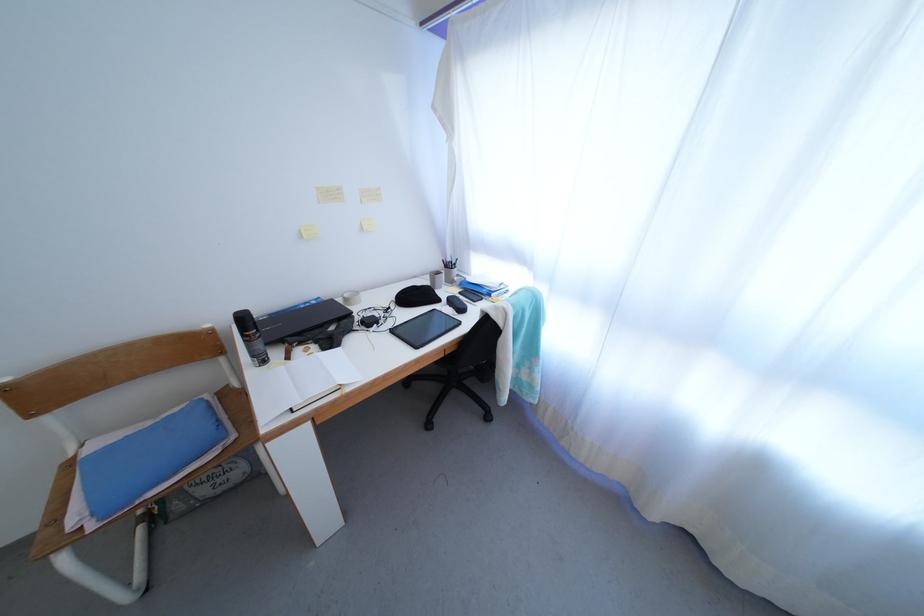
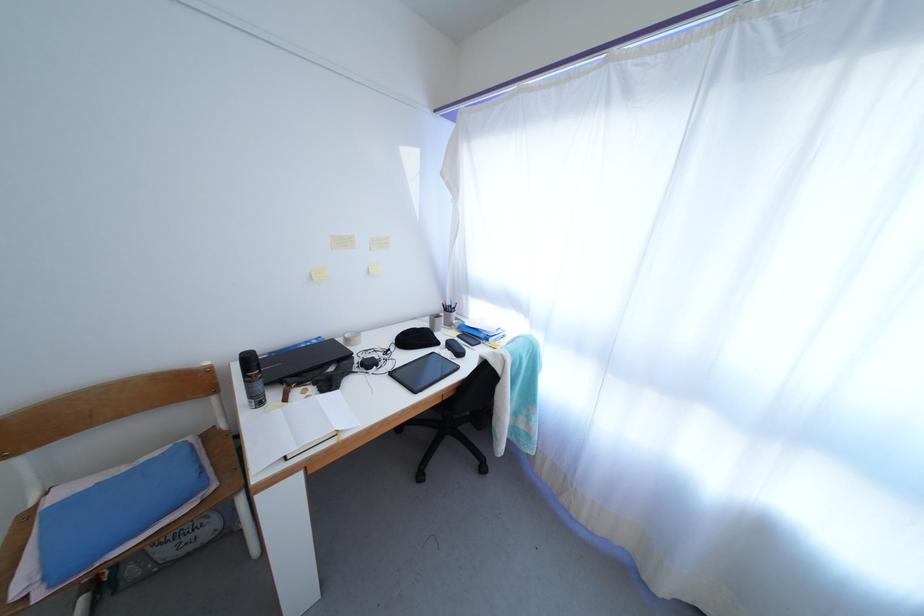
Where in the second image is the point corresponding to pixel 398 337 from the first image?

(397, 379)